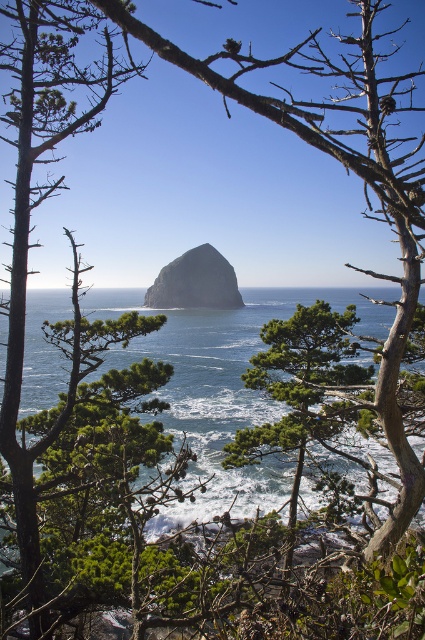
Question: Which point is closer to the camera?

Choices:
 (A) blue water at center
 (B) gray/rocky haystack rock at center

Answer: (A)

Question: Does blue water at center appear on the right side of gray/rocky haystack rock at center?

Choices:
 (A) yes
 (B) no

Answer: (B)

Question: Which point appears closest to the camera in this image?

Choices:
 (A) (198, 337)
 (B) (161, 282)

Answer: (A)

Question: Can you confirm if blue water at center is positioned above gray/rocky haystack rock at center?

Choices:
 (A) yes
 (B) no

Answer: (B)

Question: Is blue water at center positioned behind gray/rocky haystack rock at center?

Choices:
 (A) yes
 (B) no

Answer: (B)

Question: Among these objects, which one is farthest from the camera?

Choices:
 (A) gray/rocky haystack rock at center
 (B) blue water at center

Answer: (A)